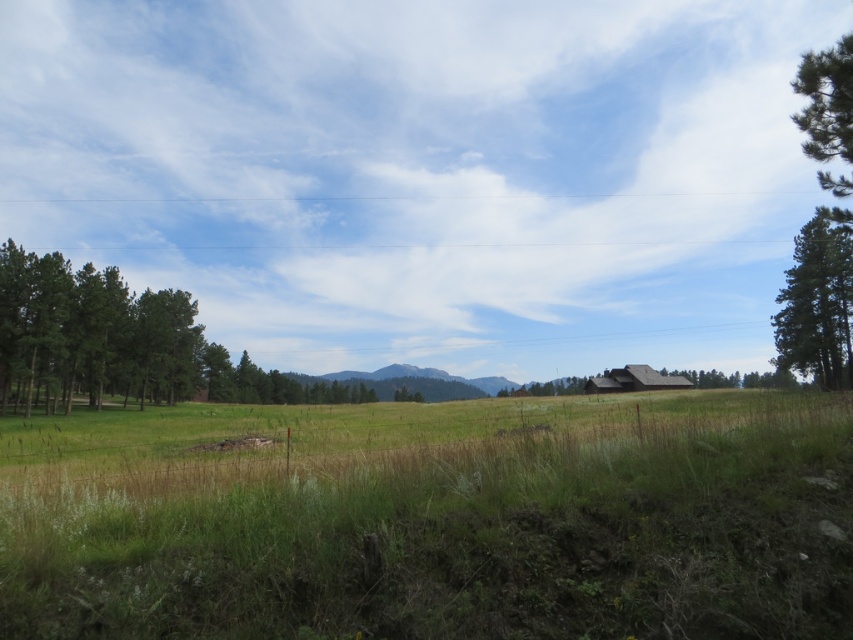
Is green grassy pasture at center closer to the viewer compared to green leafy tree at left?

That is True.

Can you confirm if green grassy pasture at center is thinner than green leafy tree at left?

No.

This screenshot has width=853, height=640. Find the location of `green grassy pasture at center`. green grassy pasture at center is located at coordinates (434, 520).

Is green leafy tree at left wider than brown wooden hut at lower right?

Indeed, green leafy tree at left has a greater width compared to brown wooden hut at lower right.

Is point (178, 298) closer to viewer compared to point (610, 385)?

That is True.

Where is `green leafy tree at left`? The width and height of the screenshot is (853, 640). green leafy tree at left is located at coordinates (119, 342).

Is green textured tree at right further to the viewer compared to green textured pine tree at upper right?

That is True.

Does green textured tree at right appear under green textured pine tree at upper right?

Correct, green textured tree at right is located below green textured pine tree at upper right.

Does point (816, 285) come behind point (813, 141)?

Yes, point (816, 285) is behind point (813, 141).

You are a GUI agent. You are given a task and a screenshot of the screen. Output one action in this format:
    pyautogui.click(x=<x>, y=<y>)
    Task: Click on the green textured tree at right
    
    Given the screenshot: What is the action you would take?
    pyautogui.click(x=817, y=305)